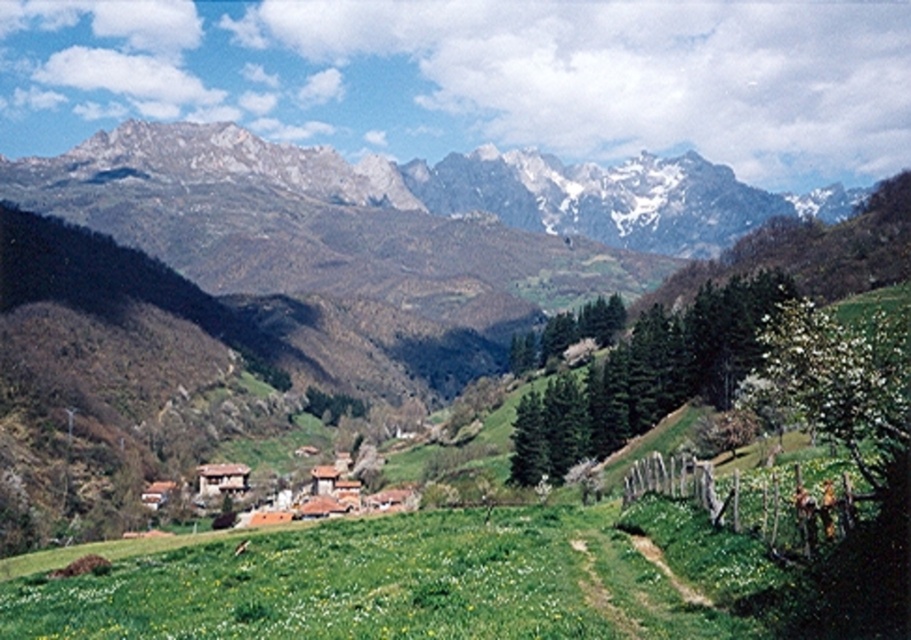
Is point (676, 157) positioned in front of point (361, 486)?

No.

Who is more distant from viewer, (504, 176) or (381, 497)?

The point (504, 176) is behind.

Which is in front, point (510, 163) or point (321, 499)?

Positioned in front is point (321, 499).

Where is `rugged stone mountain range at upper center`? Image resolution: width=911 pixels, height=640 pixels. rugged stone mountain range at upper center is located at coordinates (452, 184).